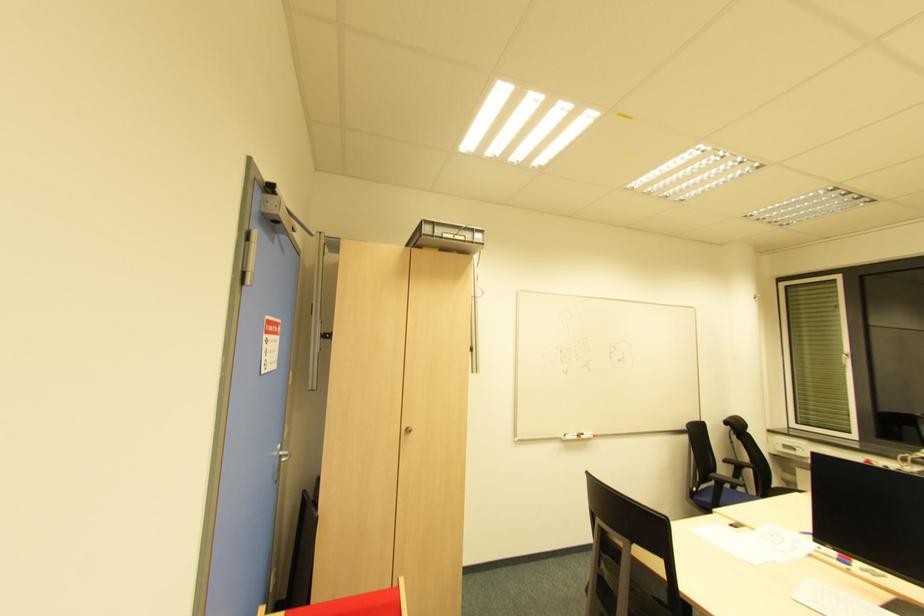
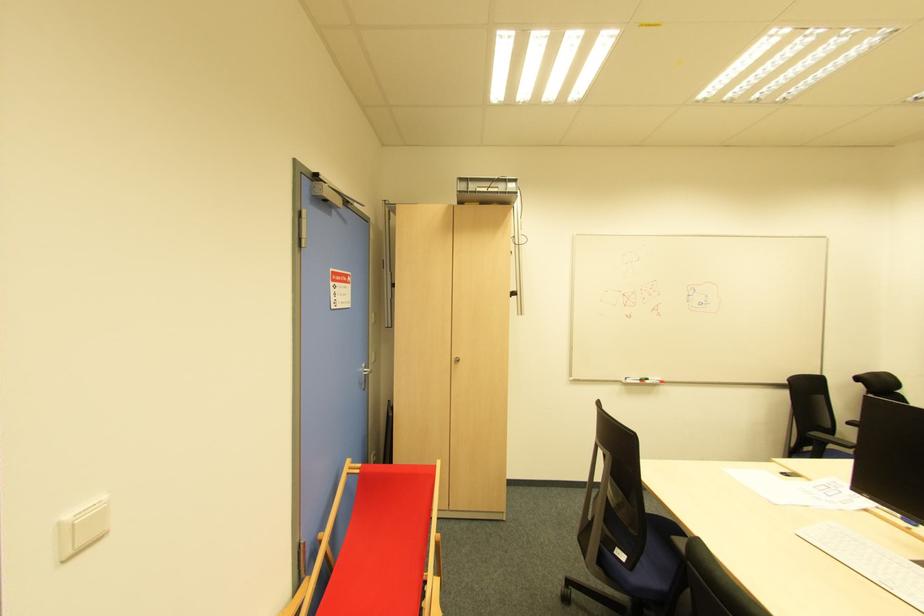
Find the pixel in the second image that matches (713,477) in the first image.

(817, 436)